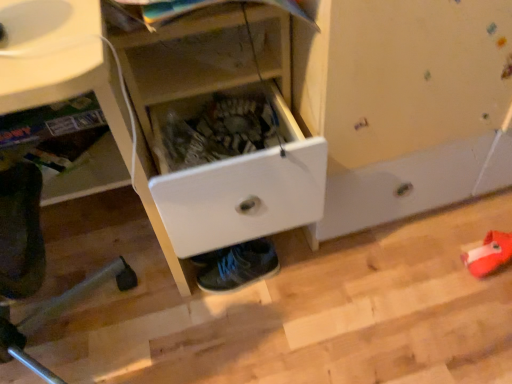
This screenshot has height=384, width=512. Find the location of `vacant region to the left of white plastic drawer at center`. vacant region to the left of white plastic drawer at center is located at coordinates (129, 250).